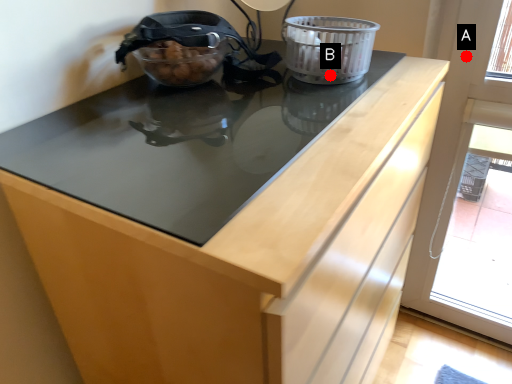
Question: Two points are circled on the image, labeled by A and B beside each circle. Which of the following is the closest to the observer?

Choices:
 (A) A is closer
 (B) B is closer

Answer: (B)